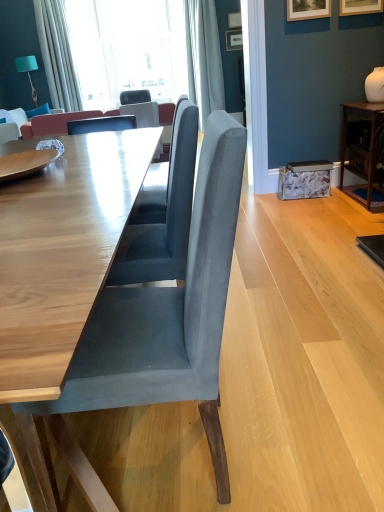
Question: Can you confirm if dark wood table at right, acting as the second table starting from the front, is bigger than wooden picture frame at upper right, marked as the 3th picture frame in a top-to-bottom arrangement?

Choices:
 (A) no
 (B) yes

Answer: (B)

Question: Is dark wood table at right, which is the second table from left to right, with wooden picture frame at upper right, acting as the fourth picture frame starting from the back?

Choices:
 (A) yes
 (B) no

Answer: (B)

Question: Is dark wood table at right, marked as the 1th table in a right-to-left arrangement, positioned with its back to wooden picture frame at upper right, which appears as the 2th picture frame when ordered from the bottom?

Choices:
 (A) yes
 (B) no

Answer: (B)

Question: Is wooden picture frame at upper right, marked as the 3th picture frame in a top-to-bottom arrangement, completely or partially inside dark wood table at right, which ranks as the 1th table in back-to-front order?

Choices:
 (A) no
 (B) yes

Answer: (A)

Question: Does dark wood table at right, which ranks as the 1th table in back-to-front order, appear on the right side of wooden picture frame at upper right, marked as the 3th picture frame in a top-to-bottom arrangement?

Choices:
 (A) yes
 (B) no

Answer: (A)

Question: From the image's perspective, is dark wood table at right, marked as the 1th table in a right-to-left arrangement, beneath wooden picture frame at upper right, marked as the 3th picture frame in a top-to-bottom arrangement?

Choices:
 (A) no
 (B) yes

Answer: (B)

Question: Can you confirm if velvet blue pillow at upper left is positioned to the right of wooden picture frame at upper center, marked as the 1th picture frame in a back-to-front arrangement?

Choices:
 (A) yes
 (B) no

Answer: (B)

Question: From the image's perspective, is velvet blue pillow at upper left located beneath wooden picture frame at upper center, which ranks as the 4th picture frame in front-to-back order?

Choices:
 (A) yes
 (B) no

Answer: (A)

Question: From a real-world perspective, is velvet blue pillow at upper left under wooden picture frame at upper center, which is the second picture frame from top to bottom?

Choices:
 (A) no
 (B) yes

Answer: (B)

Question: Considering the relative sizes of velvet blue pillow at upper left and wooden picture frame at upper center, which is the second picture frame from top to bottom, in the image provided, is velvet blue pillow at upper left taller than wooden picture frame at upper center, which is the second picture frame from top to bottom,?

Choices:
 (A) no
 (B) yes

Answer: (A)

Question: From a real-world perspective, is velvet blue pillow at upper left physically above wooden picture frame at upper center, marked as the 1th picture frame in a back-to-front arrangement?

Choices:
 (A) no
 (B) yes

Answer: (A)

Question: Could you tell me if velvet blue pillow at upper left is turned towards wooden picture frame at upper center, which ranks as the 4th picture frame in front-to-back order?

Choices:
 (A) no
 (B) yes

Answer: (A)

Question: From the image's perspective, is wooden table at center, marked as the first table in a left-to-right arrangement, located above wooden picture frame at upper center, which is counted as the third picture frame, starting from the front?

Choices:
 (A) no
 (B) yes

Answer: (A)